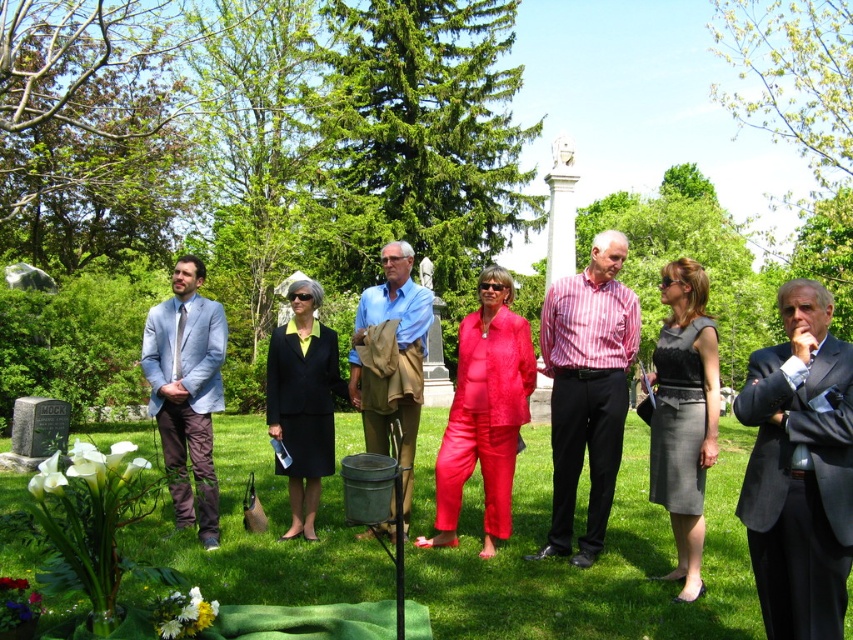
Consider the image. You are attending a memorial service and need to hand a condolence card to both the striped cotton shirt at center and the black suit at center. Which person should you approach first based on their proximity to you?

You should approach the striped cotton shirt at center first because they are closer to you than the black suit at center.